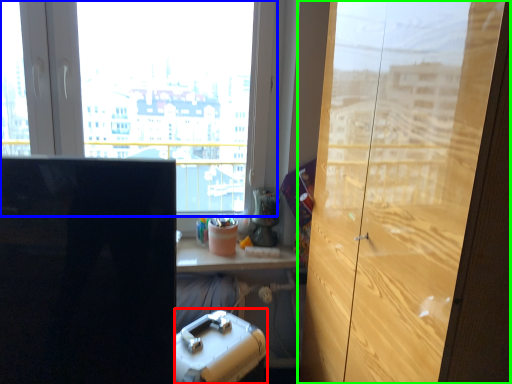
Question: Estimate the real-world distances between objects in this image. Which object is farther from stationery (highlighted by a red box), window (highlighted by a blue box) or cupboard (highlighted by a green box)?

Choices:
 (A) window
 (B) cupboard

Answer: (A)